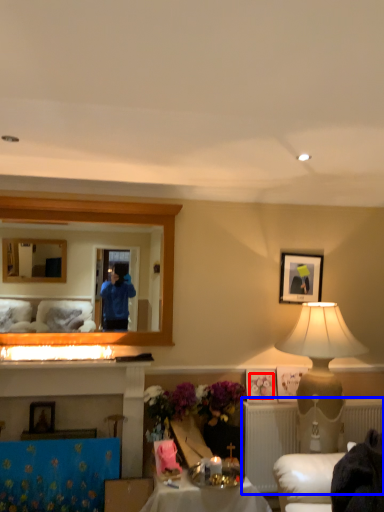
Question: Which object is further to the camera taking this photo, flower (highlighted by a red box) or radiator (highlighted by a blue box)?

Choices:
 (A) flower
 (B) radiator

Answer: (A)